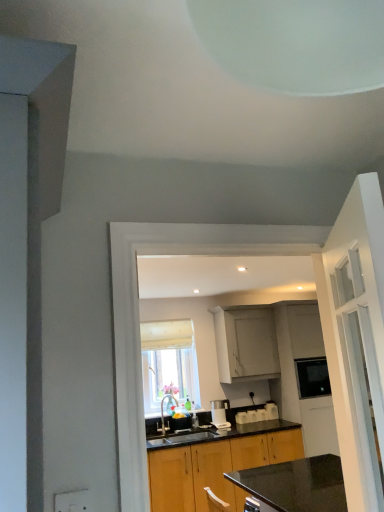
Question: Is white matte cabinet at upper center, marked as the 2th cabinetry in a bottom-to-top arrangement, positioned behind brushed metal faucet at center?

Choices:
 (A) yes
 (B) no

Answer: (A)

Question: From the image's perspective, is white matte cabinet at upper center, marked as the first cabinetry in a top-to-bottom arrangement, below brushed metal faucet at center?

Choices:
 (A) yes
 (B) no

Answer: (B)

Question: Could you tell me if white matte cabinet at upper center, marked as the first cabinetry in a top-to-bottom arrangement, is turned towards brushed metal faucet at center?

Choices:
 (A) yes
 (B) no

Answer: (B)

Question: Does white matte cabinet at upper center, marked as the 2th cabinetry in a bottom-to-top arrangement, have a lesser height compared to brushed metal faucet at center?

Choices:
 (A) no
 (B) yes

Answer: (A)

Question: From a real-world perspective, does white matte cabinet at upper center, marked as the first cabinetry in a top-to-bottom arrangement, stand above brushed metal faucet at center?

Choices:
 (A) yes
 (B) no

Answer: (A)

Question: From the image's perspective, is black granite sink at center located above or below white fabric window at center?

Choices:
 (A) below
 (B) above

Answer: (A)

Question: Based on their positions, is black granite sink at center located to the left or right of white fabric window at center?

Choices:
 (A) left
 (B) right

Answer: (B)

Question: Looking at the image, does black granite sink at center seem bigger or smaller compared to white fabric window at center?

Choices:
 (A) small
 (B) big

Answer: (A)

Question: From their relative heights in the image, would you say black granite sink at center is taller or shorter than white fabric window at center?

Choices:
 (A) tall
 (B) short

Answer: (B)

Question: Is satin silver coffee machine at center in front of or behind brushed metal faucet at center in the image?

Choices:
 (A) behind
 (B) front

Answer: (A)

Question: Considering the positions of satin silver coffee machine at center and brushed metal faucet at center in the image, is satin silver coffee machine at center taller or shorter than brushed metal faucet at center?

Choices:
 (A) short
 (B) tall

Answer: (A)

Question: From a real-world perspective, is satin silver coffee machine at center positioned above or below brushed metal faucet at center?

Choices:
 (A) above
 (B) below

Answer: (B)

Question: Based on their positions, is satin silver coffee machine at center located to the left or right of brushed metal faucet at center?

Choices:
 (A) left
 (B) right

Answer: (B)

Question: From their relative heights in the image, would you say wooden cabinet at center, the second cabinetry from the top, is taller or shorter than brushed metal faucet at center?

Choices:
 (A) short
 (B) tall

Answer: (B)

Question: From the image's perspective, relative to brushed metal faucet at center, is wooden cabinet at center, the 1th cabinetry when ordered from bottom to top, above or below?

Choices:
 (A) below
 (B) above

Answer: (A)